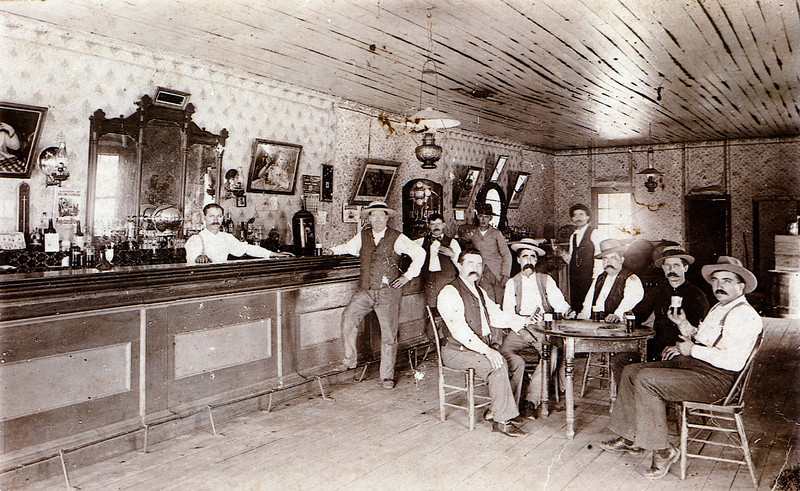
Identify the location of warped ceiling. (618, 69), (722, 77).